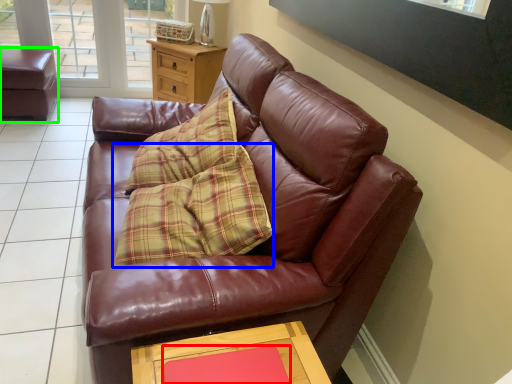
Question: Based on their relative distances, which object is nearer to flat (highlighted by a red box)? Choose from pillow (highlighted by a blue box) and swivel chair (highlighted by a green box).

Choices:
 (A) pillow
 (B) swivel chair

Answer: (A)